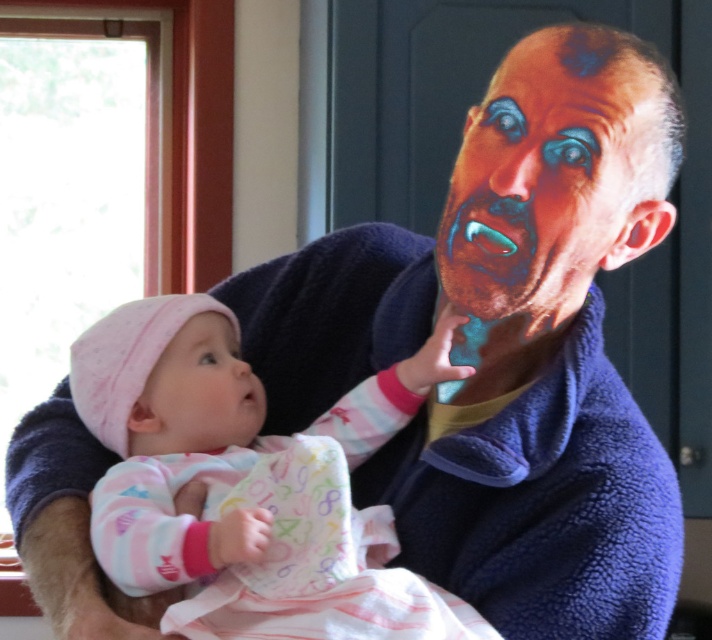
You are a photographer trying to capture a closeup shot of the shiny blue face at upper right while ensuring the pink fleece onesie at center is still visible in the frame. Given their distance, is this possible?

The pink fleece onesie at center and shiny blue face at upper right are 11.20 inches apart. Since this distance is manageable within a camera frame, yes, you can capture both the shiny blue face at upper right and the pink fleece onesie at center in the same shot.

You are a photographer trying to capture a candid shot of the shiny blue face at upper right and the pink fleece onesie at center. Since you want the baby to look natural, you decide not to move them. Based on their positions, which object should be placed closer to the camera to ensure both are in focus?

The pink fleece onesie at center is below the shiny blue face at upper right, so to have both in focus, the photographer should position the camera closer to the pink fleece onesie at center since it is farther from the shiny blue face at upper right.

You are a photographer trying to capture a closeup of the shiny blue face at upper right while ensuring the pink fleece onesie at center remains visible in the frame. Based on their sizes, will you need to adjust your camera angle to include both?

The pink fleece onesie at center is taller than the shiny blue face at upper right, so you can position the camera to focus on the shiny blue face at upper right while still keeping the pink fleece onesie at center in the frame.